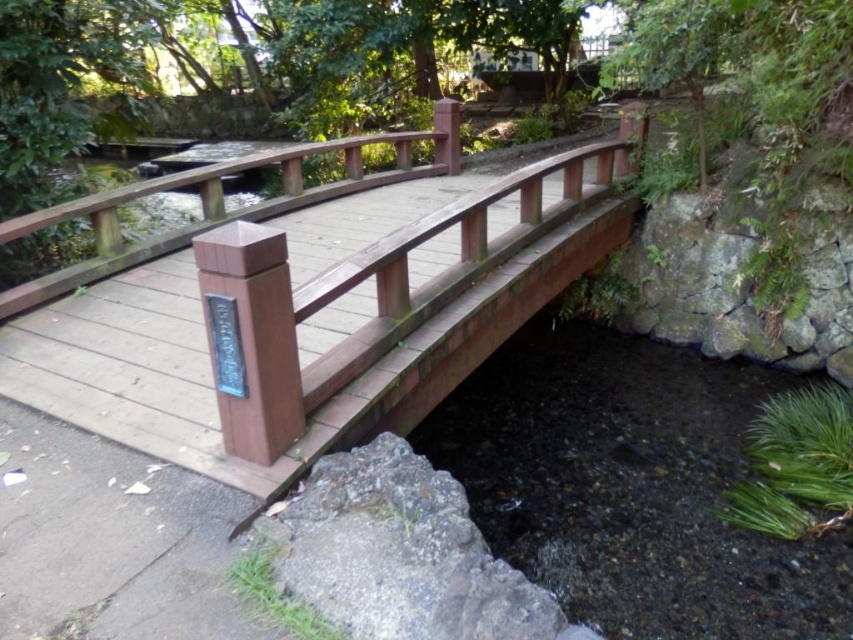
You are standing on the wooden bridge at center and want to see the gray rough stone at lower left. Which direction should you look to see it?

The gray rough stone at lower left is located below the wooden bridge at center, so you should look downward to see it.

You are standing at the coordinates point 0.5, 0.4 and want to cross the wooden bridge at center. Can you reach the bridge from your current position?

The wooden bridge at center is located at point (x=329, y=328), so yes, you can reach the bridge from your current position at (x=340, y=320) as the distance between the two points is minimal.